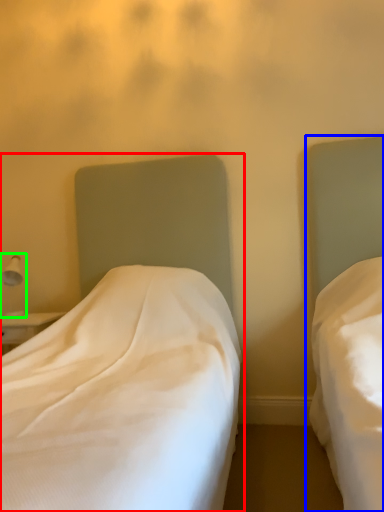
Question: Which object is the closest to the bed (highlighted by a red box)? Choose among these: bed (highlighted by a blue box) or bedside lamp (highlighted by a green box).

Choices:
 (A) bed
 (B) bedside lamp

Answer: (A)